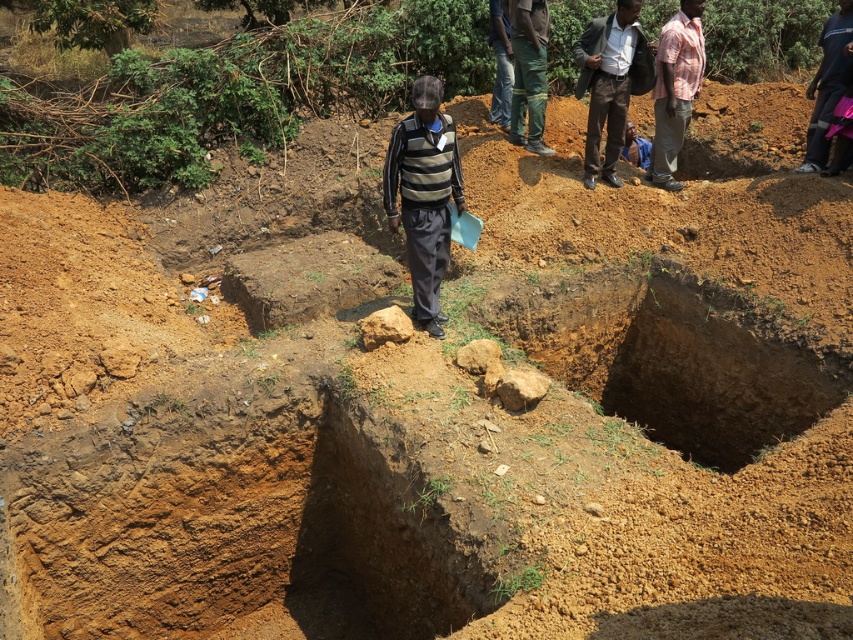
Can you confirm if brown dirt hole at center is positioned to the left of dark brown leather pants at center?

No, brown dirt hole at center is not to the left of dark brown leather pants at center.

Does point (769, 332) lie in front of point (643, 80)?

That is True.

Is point (634, 349) less distant than point (595, 88)?

Yes, point (634, 349) is closer to viewer.

The image size is (853, 640). Identify the location of brown dirt hole at center. (717, 371).

Does green camouflage pants at center appear under blue denim shirt at center?

Actually, green camouflage pants at center is above blue denim shirt at center.

Image resolution: width=853 pixels, height=640 pixels. Find the location of `green camouflage pants at center`. green camouflage pants at center is located at coordinates point(527,74).

Does dark brown leather pants at center appear over blue plastic shovel at center?

Yes.

Is dark brown leather pants at center thinner than blue plastic shovel at center?

No, dark brown leather pants at center is not thinner than blue plastic shovel at center.

Is point (625, 51) closer to viewer compared to point (456, 236)?

No, it is behind (456, 236).

Find the location of a particular element. This screenshot has height=640, width=853. dark brown leather pants at center is located at coordinates (611, 83).